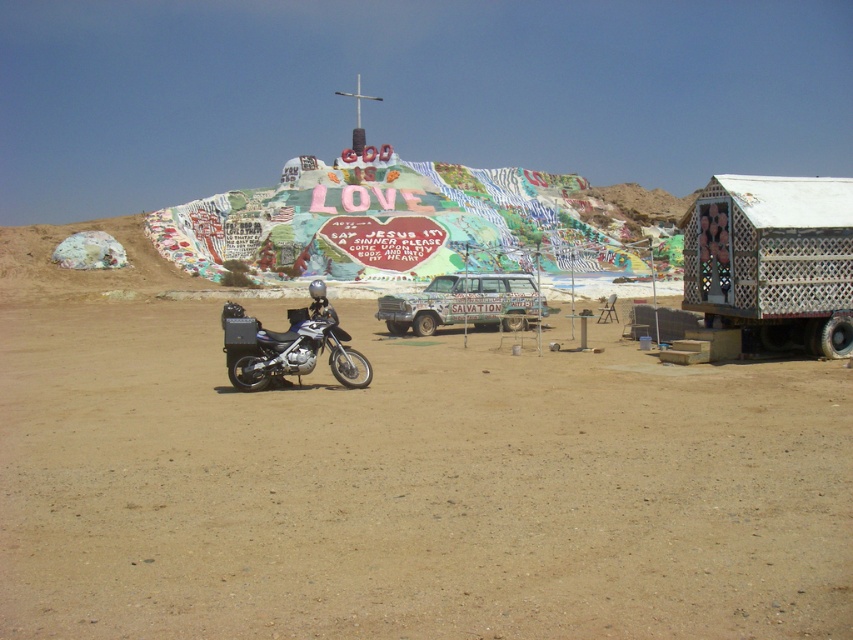
You are standing at the point with coordinates 0.5, 0.5 in the image. Which direction should you walk to reach the brown sandy ground at center?

The brown sandy ground at center is located at point (410, 488). Since you are at (426, 320), you should walk towards the right and slightly downward to reach it.

You are a traveler in the desert and want to move from the metallic blue motorcycle at lower left to the brown sandy ground at center. Which direction should you move in?

The brown sandy ground at center is to the right of the metallic blue motorcycle at lower left, so you should move to the right to reach it.

You are planning to set up a temporary campsite in the desert. You need to choose between the white lattice hut at right and the metallic blue motorcycle at lower left as your shelter. Which one provides more space for your gear?

The metallic blue motorcycle at lower left provides more space for your gear because it occupies more space than the white lattice hut at right.